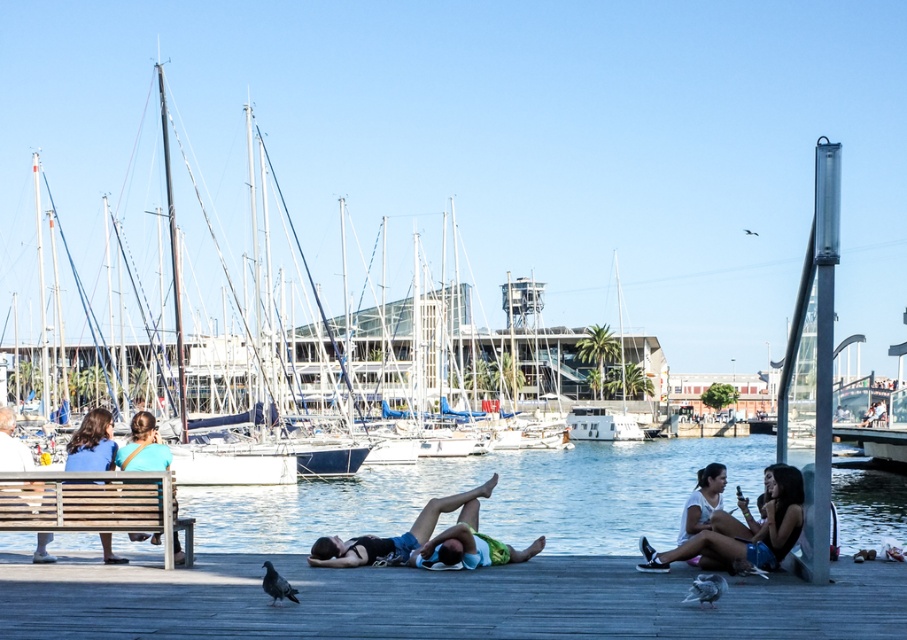
You are a photographer planning to capture the waterfront scene. You want to ensure that both the clear blue water at center and the dark blue fabric at center are visible in your shot. Based on their widths, which object should you prioritize framing first to ensure it fits within the frame?

The clear blue water at center might be wider than dark blue fabric at center, so you should prioritize framing the clear blue water at center first to ensure it fits within the frame.

In the scene shown: What is the exact location of the clear blue water at center in the image?

The clear blue water at center is located at point coordinates of (490,497).

You are standing on the wooden pier and want to sit down. You see the white sailboat at left and the blue fabric bench at lower left. Which one is closer to you?

The blue fabric bench at lower left is closer to you because the white sailboat at left is positioned over it, meaning the bench is in front and therefore nearer.